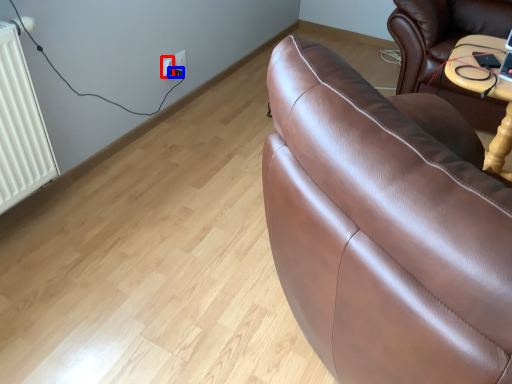
Question: Which object is closer to the camera taking this photo, electric outlet (highlighted by a red box) or plug (highlighted by a blue box)?

Choices:
 (A) electric outlet
 (B) plug

Answer: (A)